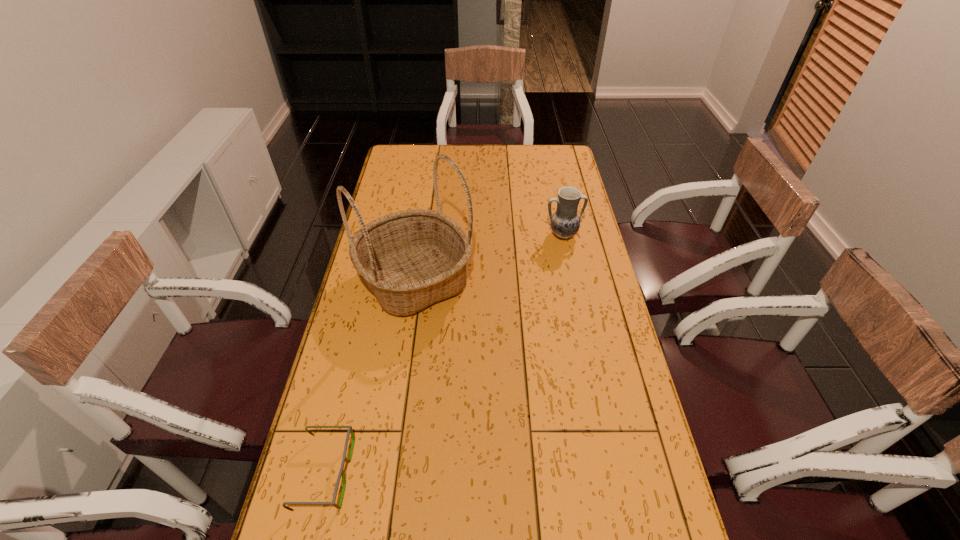
Find the location of a particular element. basket is located at coordinates (411, 259).

Where is `the second shortest object`? Image resolution: width=960 pixels, height=540 pixels. the second shortest object is located at coordinates (565, 222).

Where is `pottery`? pottery is located at coordinates (565, 222).

Identify the location of spectacles. This screenshot has height=540, width=960. (350, 430).

Locate an element on the screen. Image resolution: width=960 pixels, height=540 pixels. the nearest object is located at coordinates (350, 430).

The width and height of the screenshot is (960, 540). Find the location of `free space located on the front of the basket`. free space located on the front of the basket is located at coordinates (399, 395).

The height and width of the screenshot is (540, 960). Identify the location of free space located on the left of the pottery. (475, 235).

Locate an element on the screen. free region located on the lens of the nearest object is located at coordinates (370, 473).

In order to click on basket that is at the left edge in this screenshot , I will do `click(411, 259)`.

This screenshot has height=540, width=960. What are the coordinates of `spectacles located in the left edge section of the desktop` in the screenshot? It's located at (350, 430).